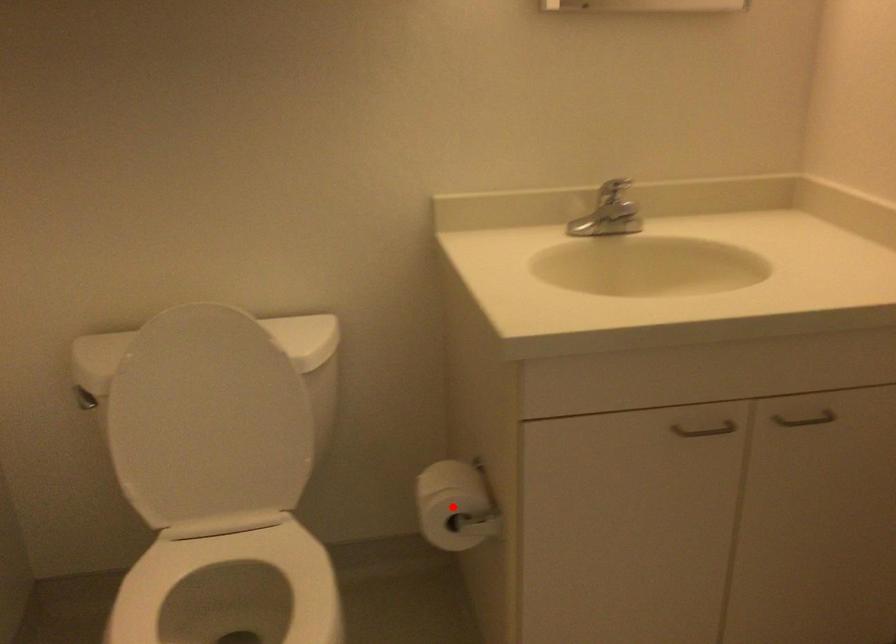
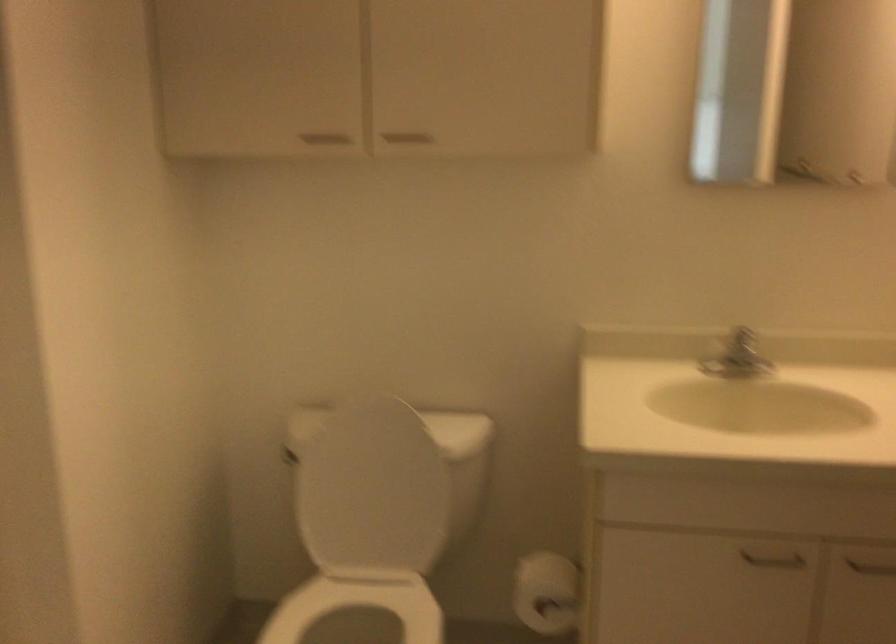
Locate, in the second image, the point that corresponds to the highlighted location in the first image.

(547, 592)